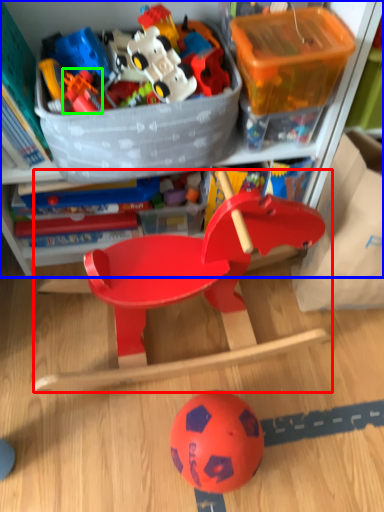
Question: Which object is positioned farthest from toy (highlighted by a red box)? Select from cabinetry (highlighted by a blue box) and toy (highlighted by a green box).

Choices:
 (A) cabinetry
 (B) toy

Answer: (B)